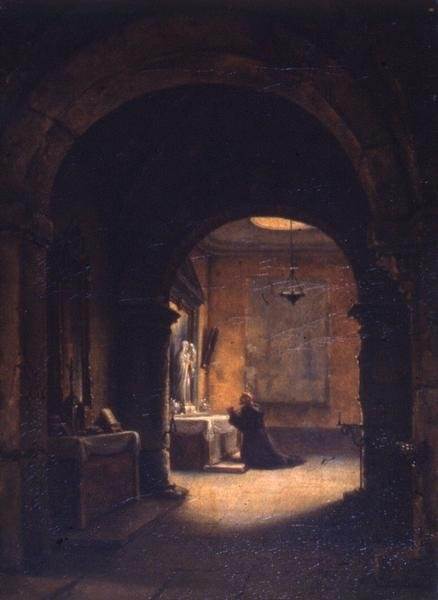
What are the coordinates of `drawers` in the screenshot? It's located at (99, 486).